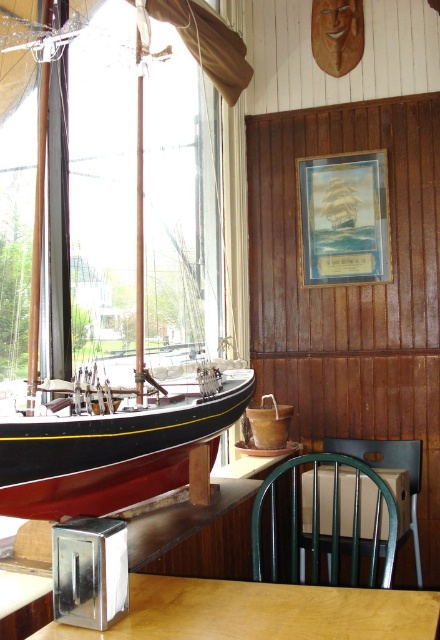
How distant is wooden table at center from green wooden chair at lower center?

wooden table at center and green wooden chair at lower center are 59.65 centimeters apart.

Is wooden table at center to the right of green wooden chair at lower center from the viewer's perspective?

No, wooden table at center is not to the right of green wooden chair at lower center.

Who is more forward, (x=217, y=602) or (x=389, y=528)?

Positioned in front is point (x=217, y=602).

The height and width of the screenshot is (640, 440). I want to click on wooden table at center, so click(261, 612).

Is the position of black polished wood boat at left less distant than that of green wooden chair at lower center?

Yes, black polished wood boat at left is closer to the viewer.

Is point (11, 400) farther from camera compared to point (344, 465)?

No, it is in front of (344, 465).

Who is more forward, [102,166] or [358,484]?

Point [358,484]

Where is `black polished wood boat at left`? black polished wood boat at left is located at coordinates (117, 305).

Is point (91, 472) behind point (140, 598)?

Yes, it is behind point (140, 598).

Does black polished wood boat at left appear over wooden table at center?

Yes.

Which is in front, point (123, 458) or point (219, 612)?

Point (219, 612)

Find the location of a particular element. The width and height of the screenshot is (440, 640). black polished wood boat at left is located at coordinates tap(117, 305).